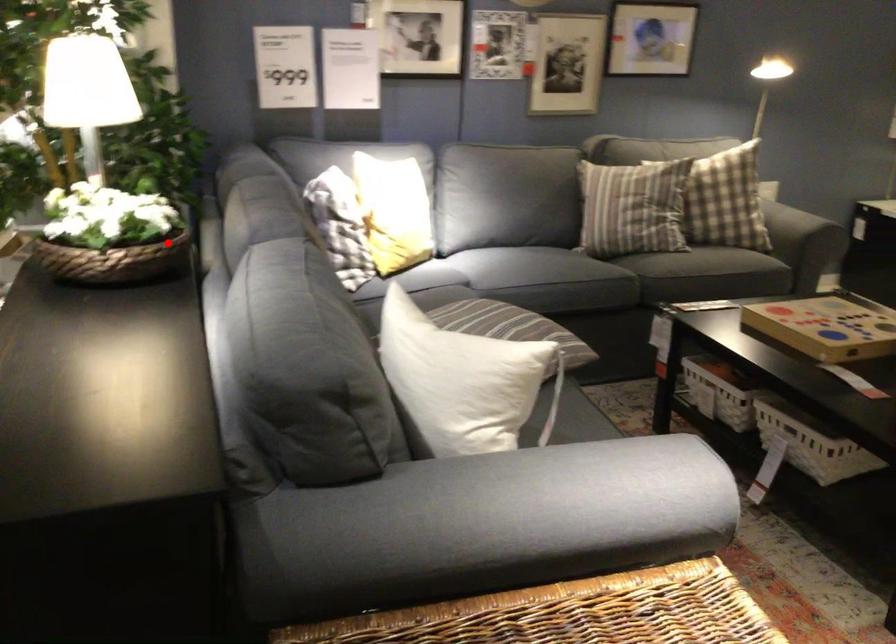
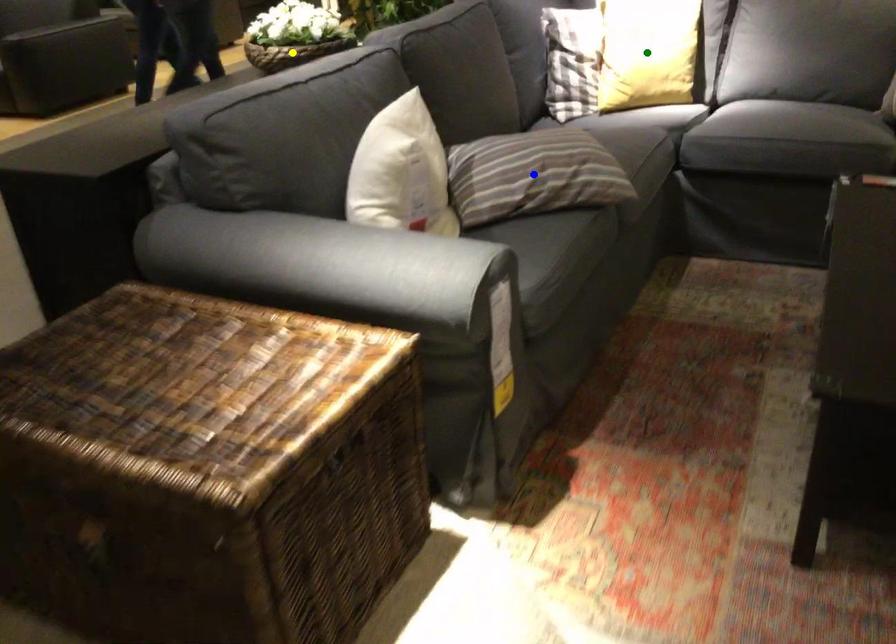
Question: I am providing you with two images of the same scene from different viewpoints. A red point is marked on the first image. You are given multiple points on the second image. Which point in image 2 is actually the same real-world point as the red point in image 1?

Choices:
 (A) blue point
 (B) yellow point
 (C) green point

Answer: (B)